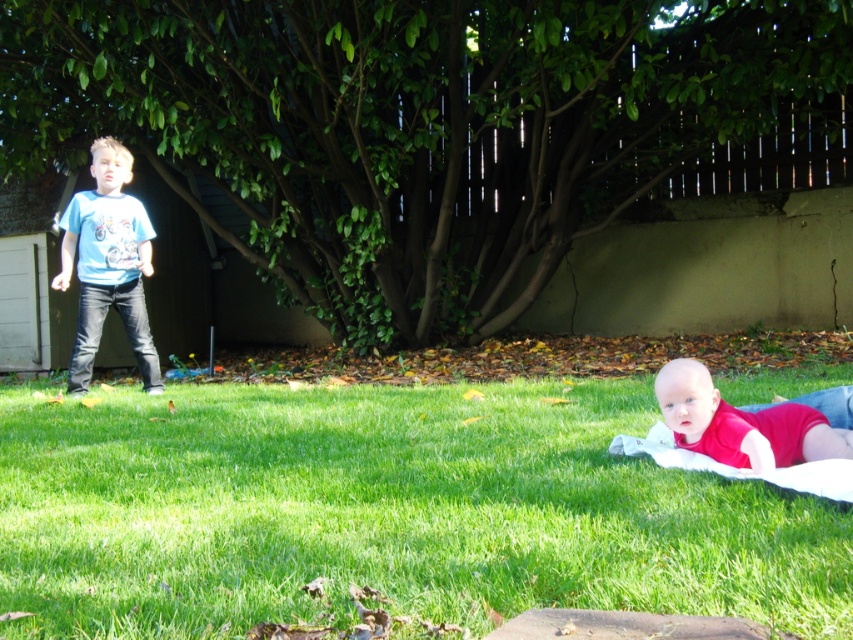
Question: Which of the following is the farthest from the observer?

Choices:
 (A) blue cotton shirt at left
 (B) green grass at lower center
 (C) red smooth baby at lower right
 (D) green leafy tree at upper center

Answer: (D)

Question: Can you confirm if green leafy tree at upper center is positioned to the right of red smooth baby at lower right?

Choices:
 (A) yes
 (B) no

Answer: (A)

Question: Which object is closer to the camera taking this photo?

Choices:
 (A) red smooth baby at lower right
 (B) green grass at lower center
 (C) blue cotton shirt at left

Answer: (B)

Question: Observing the image, what is the correct spatial positioning of green leafy tree at upper center in reference to blue cotton shirt at left?

Choices:
 (A) above
 (B) below

Answer: (A)

Question: Which point is farther from the camera taking this photo?

Choices:
 (A) (140, 240)
 (B) (490, 472)
 (C) (646, 12)

Answer: (A)

Question: Does green grass at lower center appear over blue cotton shirt at left?

Choices:
 (A) no
 (B) yes

Answer: (A)